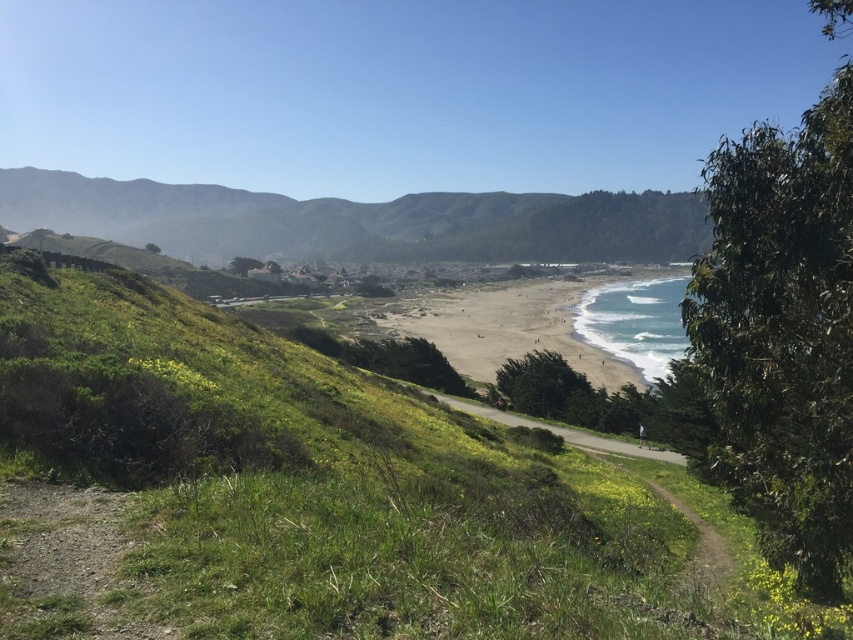
Question: Which point appears farthest from the camera in this image?

Choices:
 (A) (369, 218)
 (B) (454, 307)
 (C) (122, 410)

Answer: (A)

Question: Which of the following is the closest to the observer?

Choices:
 (A) green grassy hillside at center
 (B) green grassy hillside at lower left

Answer: (B)

Question: Is green grassy hillside at lower left smaller than sandy beach at center?

Choices:
 (A) no
 (B) yes

Answer: (B)

Question: Is green grassy hillside at center positioned in front of sandy beach at center?

Choices:
 (A) no
 (B) yes

Answer: (A)

Question: Is green grassy hillside at center positioned behind sandy beach at center?

Choices:
 (A) yes
 (B) no

Answer: (A)

Question: Among these points, which one is farthest from the camera?

Choices:
 (A) (230, 256)
 (B) (498, 291)
 (C) (283, 529)

Answer: (A)